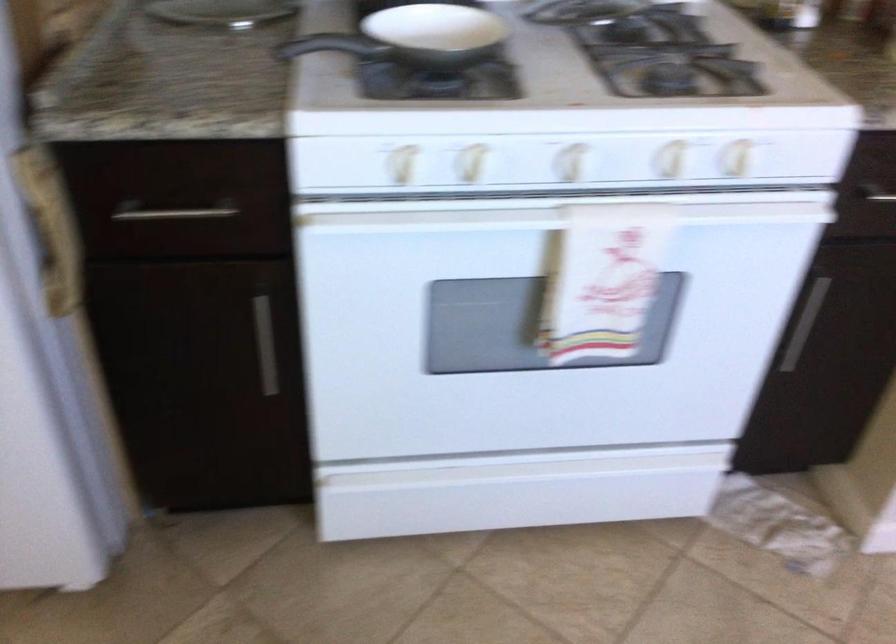
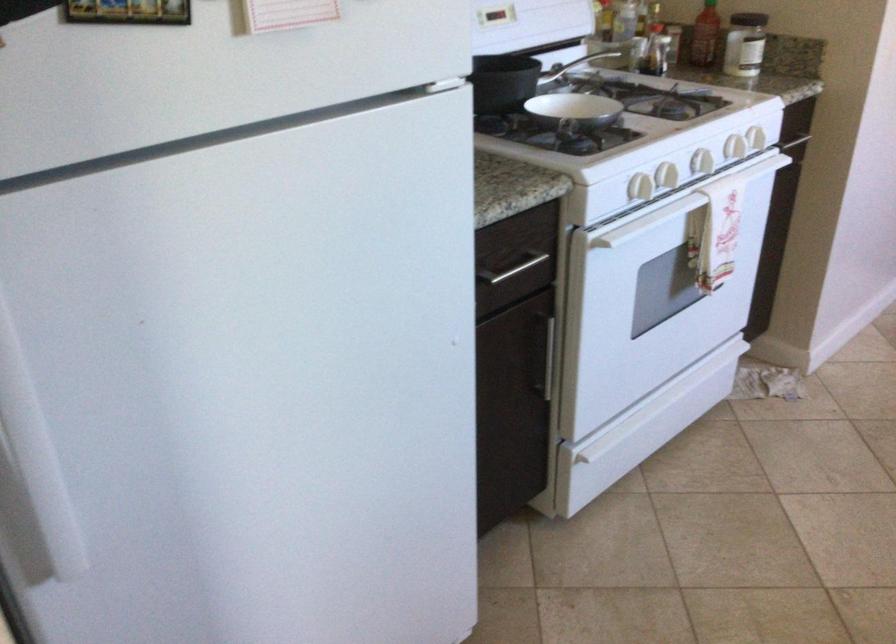
Where in the second image is the point corresponding to (141,234) from the first image?

(512, 268)